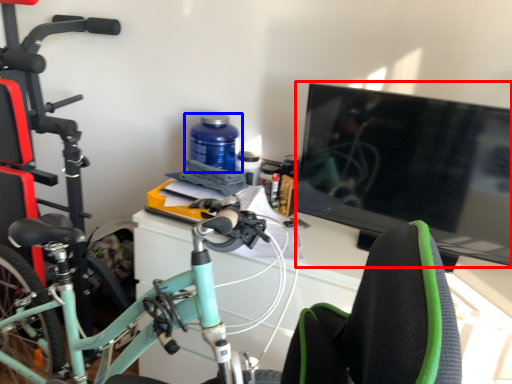
Question: Which of the following is the farthest to the observer, television (highlighted by a red box) or bottle (highlighted by a blue box)?

Choices:
 (A) television
 (B) bottle

Answer: (B)